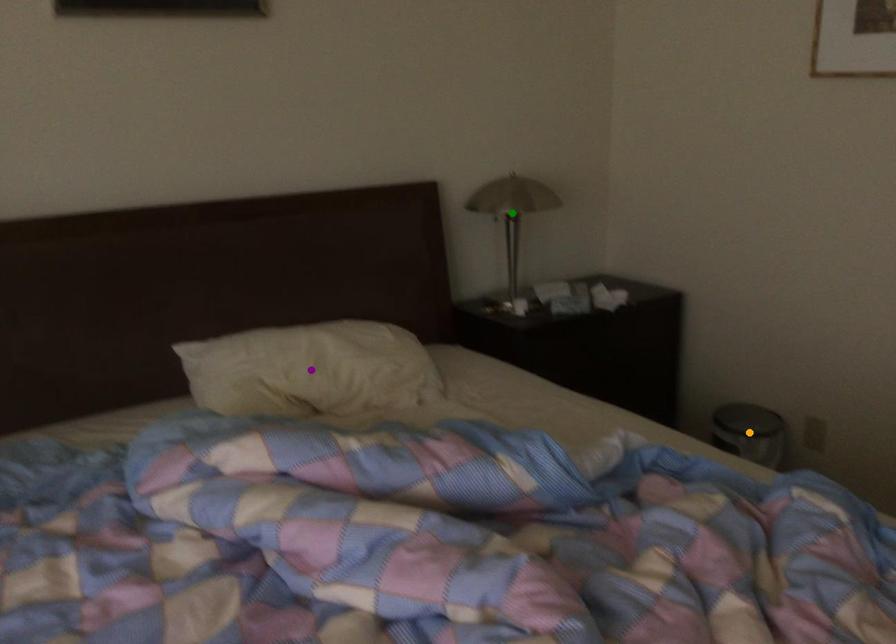
Order these from farthest to nearest:
green point, purple point, orange point

green point < orange point < purple point